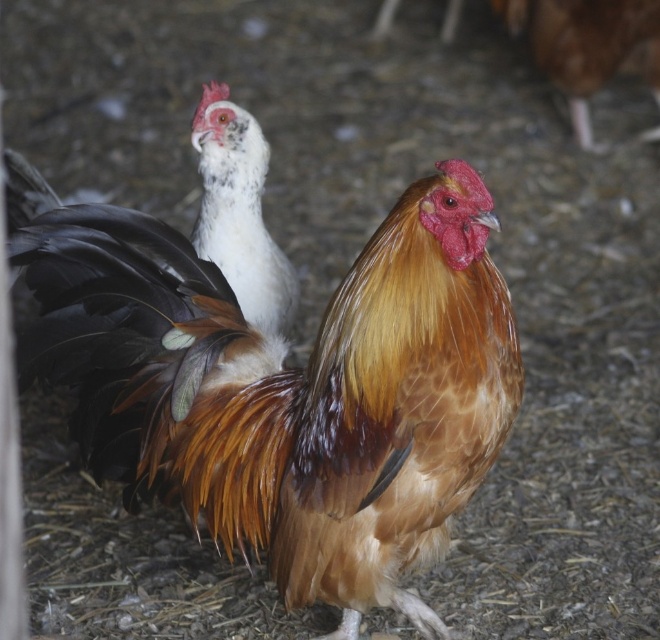
Question: From the image, what is the correct spatial relationship of brown feathered rooster at center in relation to white feathered chicken at upper left?

Choices:
 (A) above
 (B) below

Answer: (B)

Question: Which object appears farthest from the camera in this image?

Choices:
 (A) white feathered chicken at upper left
 (B) brown feathered rooster at center

Answer: (A)

Question: Does brown feathered rooster at center appear under white feathered chicken at upper left?

Choices:
 (A) no
 (B) yes

Answer: (B)

Question: Considering the relative positions of brown feathered rooster at center and white feathered chicken at upper left in the image provided, where is brown feathered rooster at center located with respect to white feathered chicken at upper left?

Choices:
 (A) below
 (B) above

Answer: (A)